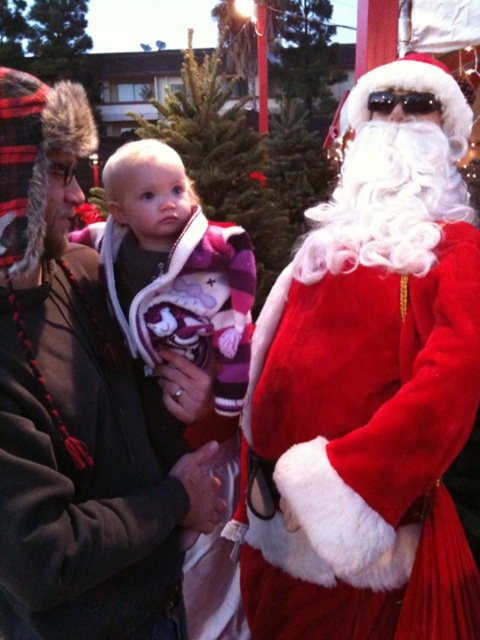
Can you confirm if velvet red santa claus at right is taller than fuzzy fur hat at upper left?

Correct, velvet red santa claus at right is much taller as fuzzy fur hat at upper left.

Can you confirm if velvet red santa claus at right is positioned below fuzzy fur hat at upper left?

No, velvet red santa claus at right is not below fuzzy fur hat at upper left.

Is point (412, 470) positioned behind point (96, 262)?

No, (412, 470) is in front of (96, 262).

Where is `velvet red santa claus at right`? The width and height of the screenshot is (480, 640). velvet red santa claus at right is located at coordinates (369, 385).